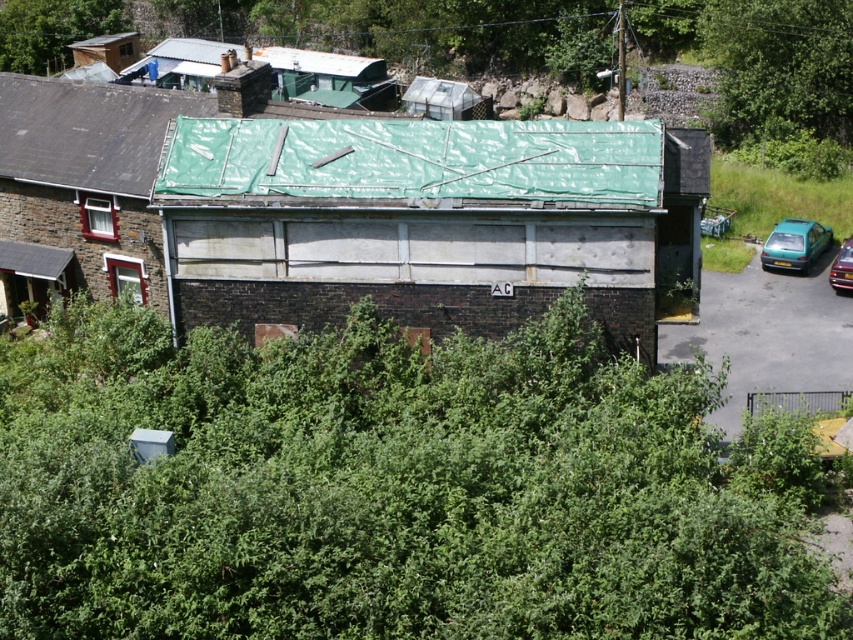
In the scene shown: Between green tarpaulin at center and green matte hatchback at right, which one appears on the right side from the viewer's perspective?

green matte hatchback at right

Does green tarpaulin at center appear under green matte hatchback at right?

No.

At what (x,y) coordinates should I click in order to perform the action: click on green tarpaulin at center. Please return your answer as a coordinate pair (x, y). The width and height of the screenshot is (853, 640). Looking at the image, I should click on (416, 160).

Where is `green tarpaulin at center`? The image size is (853, 640). green tarpaulin at center is located at coordinates (416, 160).

Between green tarpaulin at center and metallic green car at right, which one has more height?

green tarpaulin at center is taller.

Which is in front, point (216, 136) or point (834, 264)?

Positioned in front is point (216, 136).

At what (x,y) coordinates should I click in order to perform the action: click on green tarpaulin at center. Please return your answer as a coordinate pair (x, y). Looking at the image, I should click on (416, 160).

The image size is (853, 640). Describe the element at coordinates (416, 160) in the screenshot. I see `green tarpaulin at center` at that location.

Does green tarpaulin at center appear under green tarp at upper center?

Yes, green tarpaulin at center is below green tarp at upper center.

Describe the element at coordinates (416, 160) in the screenshot. I see `green tarpaulin at center` at that location.

At what (x,y) coordinates should I click in order to perform the action: click on green tarpaulin at center. Please return your answer as a coordinate pair (x, y). This screenshot has width=853, height=640. Looking at the image, I should click on [x=416, y=160].